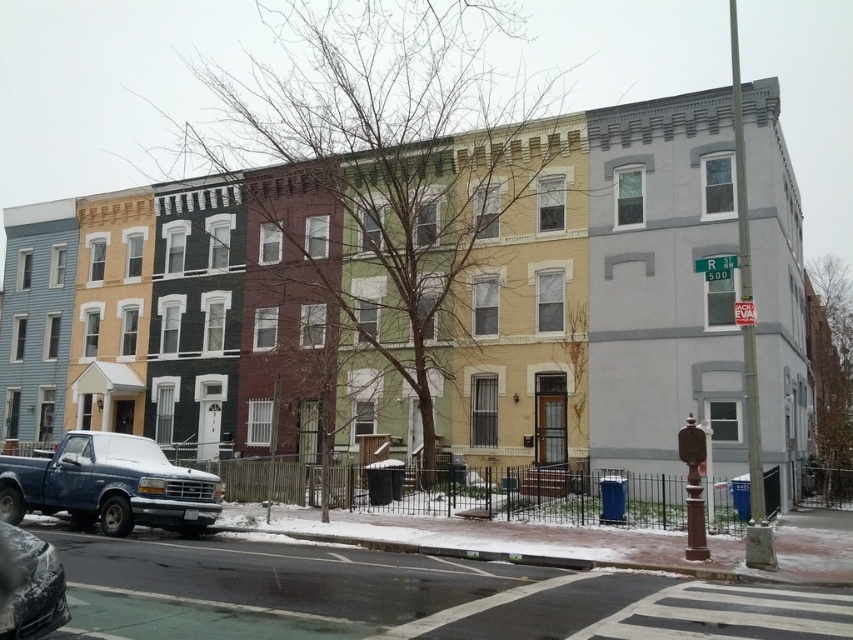
Question: Among these objects, which one is farthest from the camera?

Choices:
 (A) snow-covered car at lower left
 (B) blue matte truck at lower left

Answer: (B)

Question: Does blue matte truck at lower left appear on the right side of snow-covered car at lower left?

Choices:
 (A) yes
 (B) no

Answer: (B)

Question: Observing the image, what is the correct spatial positioning of blue matte truck at lower left in reference to snow-covered car at lower left?

Choices:
 (A) below
 (B) above

Answer: (A)

Question: Which object appears farthest from the camera in this image?

Choices:
 (A) blue matte truck at lower left
 (B) snow-covered car at lower left

Answer: (A)

Question: Does blue matte truck at lower left appear over snow-covered car at lower left?

Choices:
 (A) yes
 (B) no

Answer: (B)